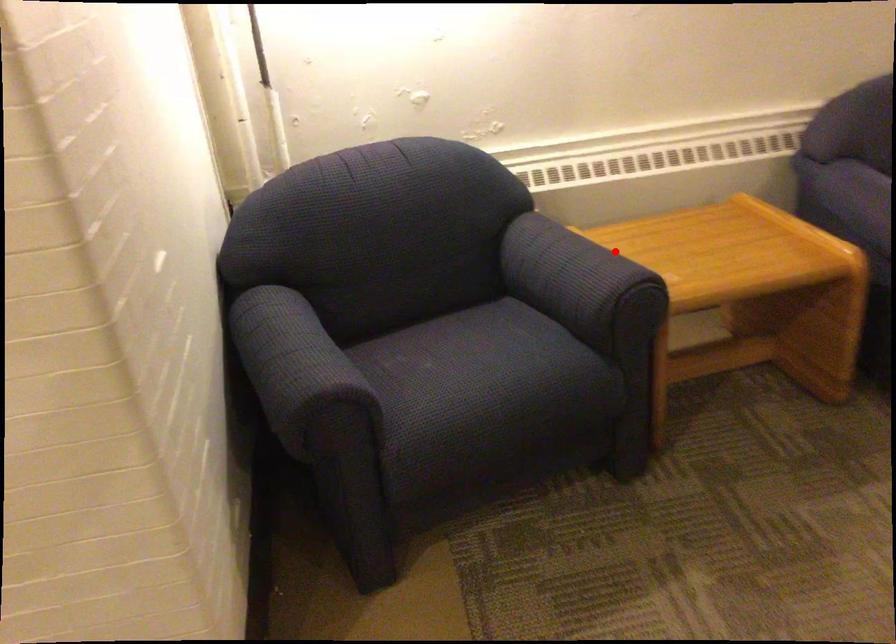
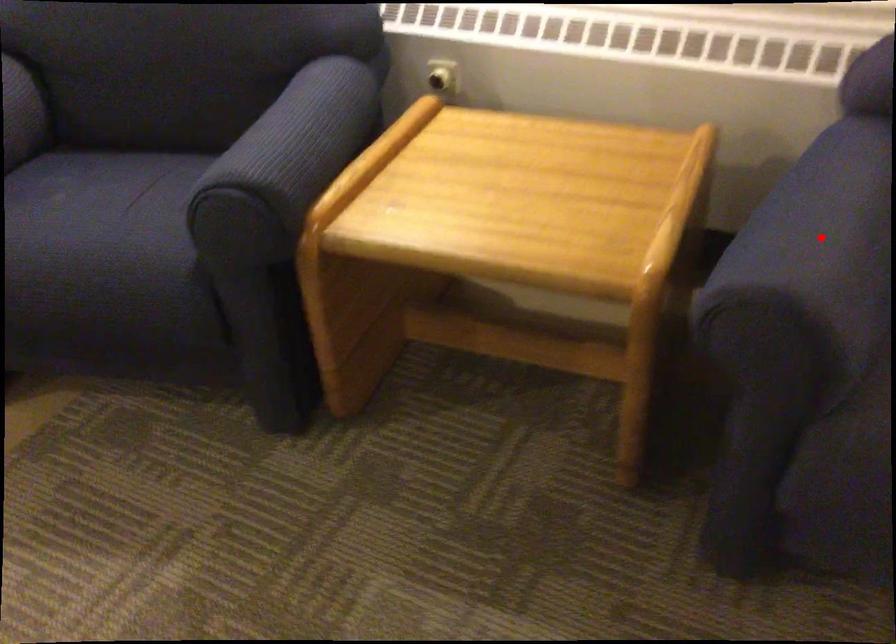
Based on the photo, I am providing you with two images of the same scene from different viewpoints. A red point is marked on the first image and another point is marked on the second image. Is the marked point in image1 the same physical position as the marked point in image2?

No